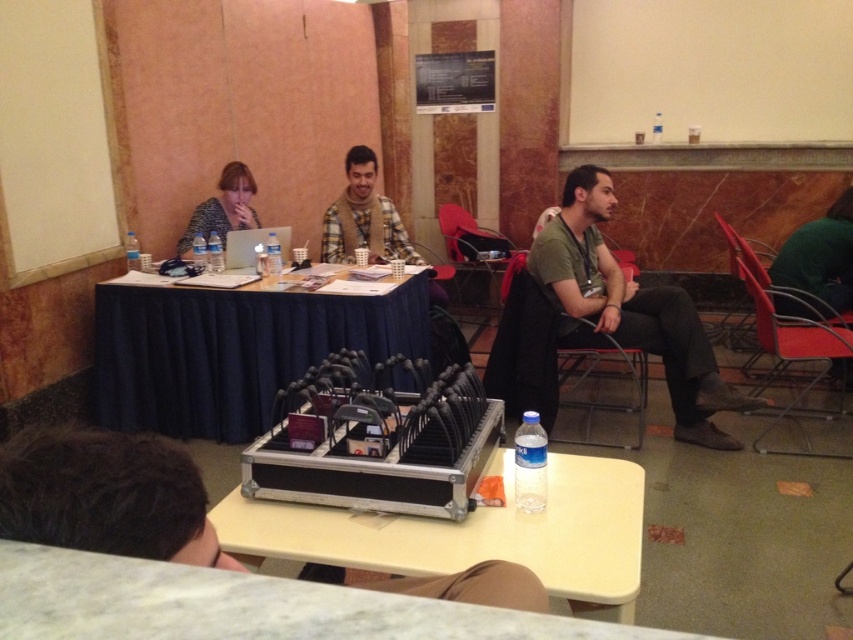
Question: Is green cotton shirt at center positioned in front of matte black laptop at upper left?

Choices:
 (A) yes
 (B) no

Answer: (A)

Question: Can you confirm if blue fabric table at center is wider than matte black case at center?

Choices:
 (A) yes
 (B) no

Answer: (A)

Question: Estimate the real-world distances between objects in this image. Which object is farther from the green cotton shirt at center?

Choices:
 (A) matte black laptop at upper left
 (B) plaid fabric shirt at center

Answer: (A)

Question: Estimate the real-world distances between objects in this image. Which object is farther from the matte black laptop at upper left?

Choices:
 (A) matte black case at center
 (B) green cotton shirt at center
 (C) blue fabric table at center
 (D) plaid fabric shirt at center

Answer: (A)

Question: Can you confirm if blue fabric table at center is bigger than matte black laptop at upper left?

Choices:
 (A) no
 (B) yes

Answer: (B)

Question: Estimate the real-world distances between objects in this image. Which object is closer to the plaid fabric shirt at center?

Choices:
 (A) matte black laptop at upper left
 (B) matte black case at center
 (C) blue fabric table at center
 (D) green cotton shirt at center

Answer: (A)